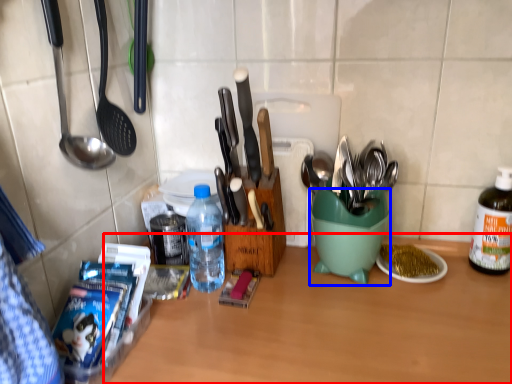
Question: Which object appears closest to the camera in this image, table (highlighted by a red box) or mixing bowl (highlighted by a blue box)?

Choices:
 (A) table
 (B) mixing bowl

Answer: (A)